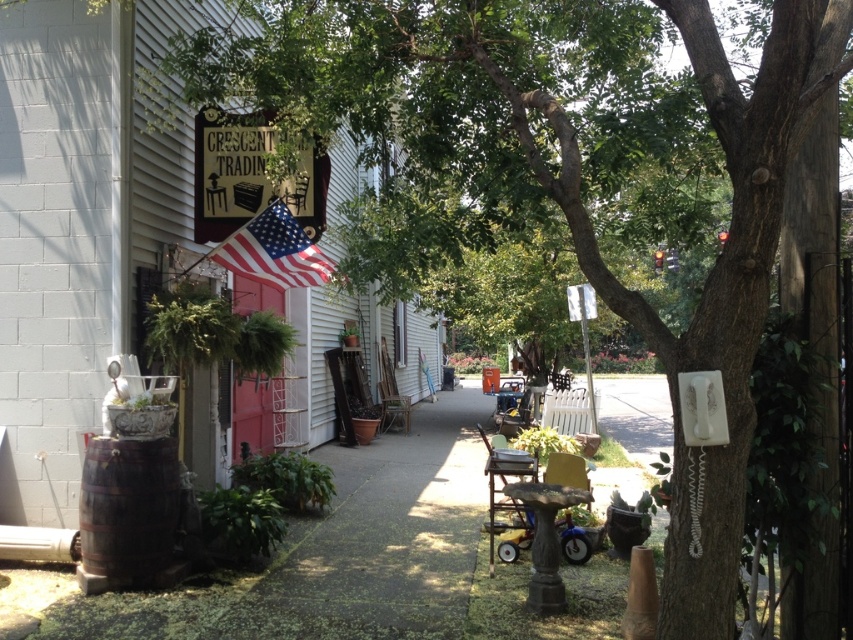
Is wooden sign at center thinner than wooden sign at upper center?

In fact, wooden sign at center might be wider than wooden sign at upper center.

Is point (102, 259) farther from viewer compared to point (196, 200)?

No, (102, 259) is in front of (196, 200).

Is point (206, 429) farther from camera compared to point (223, 179)?

Yes.

Where is `wooden sign at center`? Image resolution: width=853 pixels, height=640 pixels. wooden sign at center is located at coordinates (80, 221).

From the picture: Can you confirm if wooden sign at center is positioned to the right of american flag at upper left?

In fact, wooden sign at center is to the left of american flag at upper left.

Which of these two, wooden sign at center or american flag at upper left, stands shorter?

Standing shorter between the two is american flag at upper left.

Between point (109, 54) and point (268, 216), which one is positioned in front?

Point (109, 54) is in front.

Where is `wooden sign at center`? wooden sign at center is located at coordinates (80, 221).

Which is in front, point (314, 228) or point (279, 221)?

Point (279, 221)

Does wooden sign at upper center appear under american flag at upper left?

Incorrect, wooden sign at upper center is not positioned below american flag at upper left.

Find the location of a particular element. Image resolution: width=853 pixels, height=640 pixels. wooden sign at upper center is located at coordinates (248, 177).